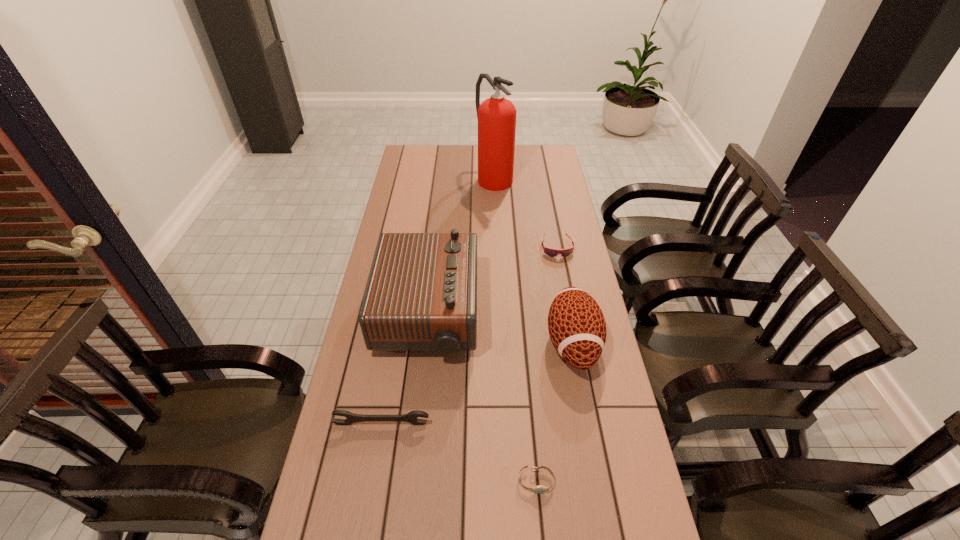
Locate an element on the screen. The image size is (960, 540). free space at the far edge of the desktop is located at coordinates (461, 164).

The width and height of the screenshot is (960, 540). In order to click on vacant space at the left edge of the desktop in this screenshot , I will do `click(395, 181)`.

You are a GUI agent. You are given a task and a screenshot of the screen. Output one action in this format:
    pyautogui.click(x=<x>, y=<y>)
    Task: Click on the vacant position at the right edge of the desktop
    The width and height of the screenshot is (960, 540).
    Given the screenshot: What is the action you would take?
    coord(556,278)

In the image, there is a desktop. Where is `vacant space at the far right corner`? This screenshot has width=960, height=540. vacant space at the far right corner is located at coordinates (535, 160).

Locate an element on the screen. The image size is (960, 540). free space between the nearest object and the second shortest object is located at coordinates (546, 364).

Image resolution: width=960 pixels, height=540 pixels. I want to click on blank region between the goggles and the tallest object, so click(525, 212).

The image size is (960, 540). Find the location of `empty location between the nearest object and the fire extinguisher`. empty location between the nearest object and the fire extinguisher is located at coordinates (515, 329).

The image size is (960, 540). Find the location of `free spot between the farthest object and the fifth tallest object`. free spot between the farthest object and the fifth tallest object is located at coordinates (525, 212).

Where is `vacant space in between the nearest object and the second tallest object`? The image size is (960, 540). vacant space in between the nearest object and the second tallest object is located at coordinates (482, 398).

Locate an element on the screen. The image size is (960, 540). free space between the goggles and the radio receiver is located at coordinates (492, 281).